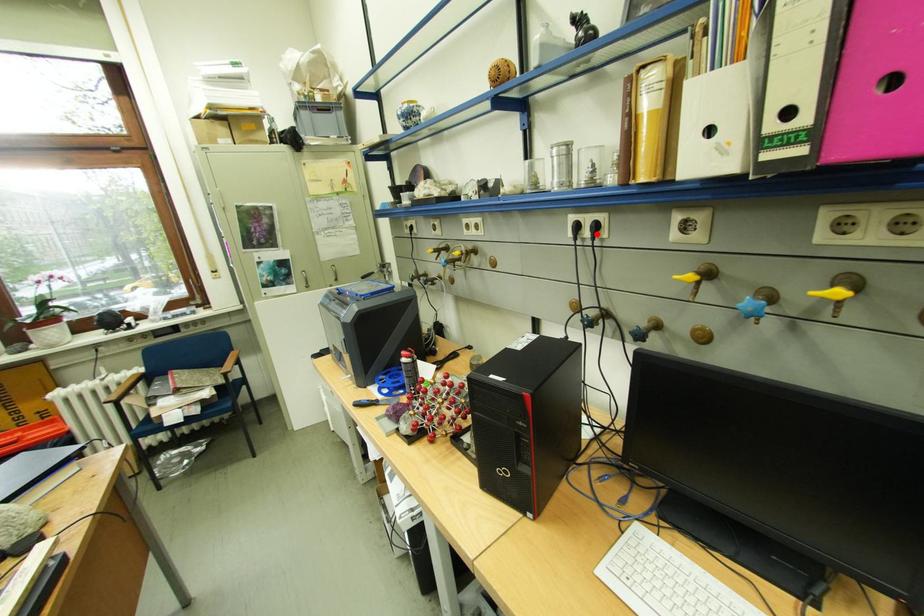
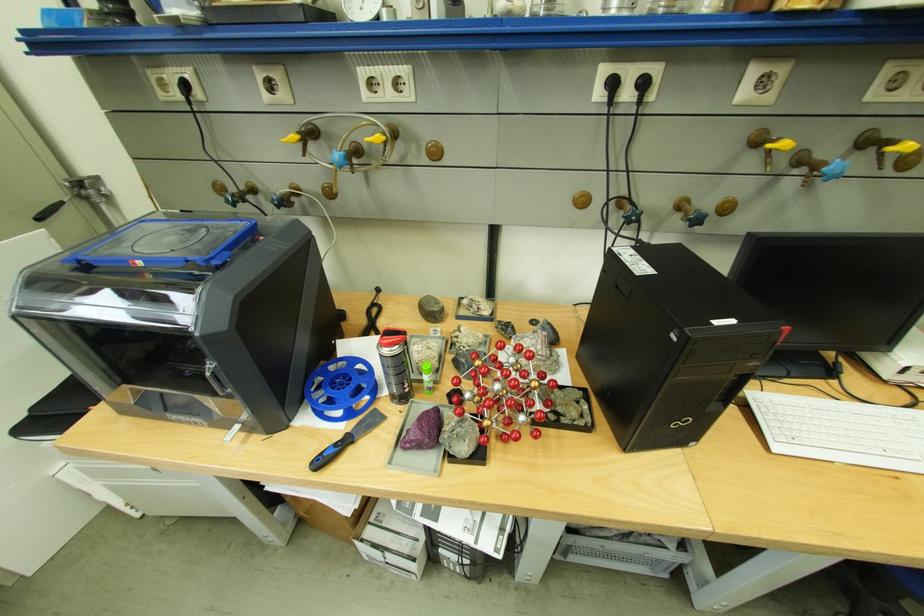
Find the pixel in the second image that matches the highlighted location in the first image.

(638, 95)